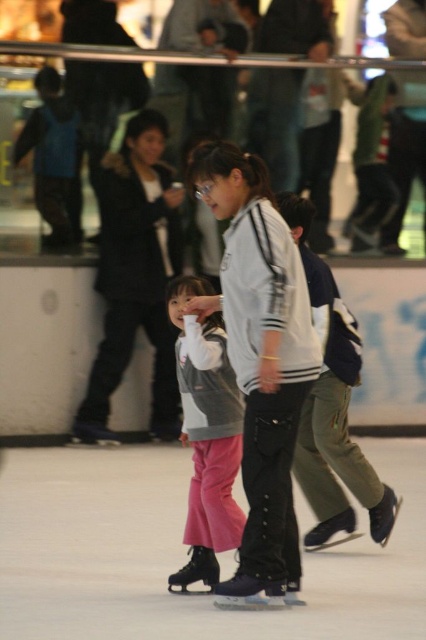
Who is higher up, white matte jacket at center or matte black jacket at center?

matte black jacket at center is higher up.

In the scene shown: How far apart are white matte jacket at center and matte black jacket at center?

4.36 meters

In order to click on white matte jacket at center in this screenshot , I will do `click(259, 364)`.

Which is in front, point (141, 240) or point (190, 502)?

Positioned in front is point (190, 502).

Who is higher up, matte black jacket at center or matte gray vest at center?

Positioned higher is matte black jacket at center.

Measure the distance between point (166,422) and camera.

Point (166,422) is 10.06 meters away from camera.

At what (x,y) coordinates should I click in order to perform the action: click on matte black jacket at center. Please return your answer as a coordinate pair (x, y). Image resolution: width=426 pixels, height=640 pixels. Looking at the image, I should click on (135, 276).

Does pink fabric pants at center have a lesser width compared to matte black jacket at center?

Incorrect, pink fabric pants at center's width is not less than matte black jacket at center's.

Who is positioned more to the left, pink fabric pants at center or matte black jacket at center?

From the viewer's perspective, pink fabric pants at center appears more on the left side.

Which is in front, point (17, 637) or point (164, 426)?

Point (17, 637) is more forward.

Find the location of a particular element. pink fabric pants at center is located at coordinates (184, 554).